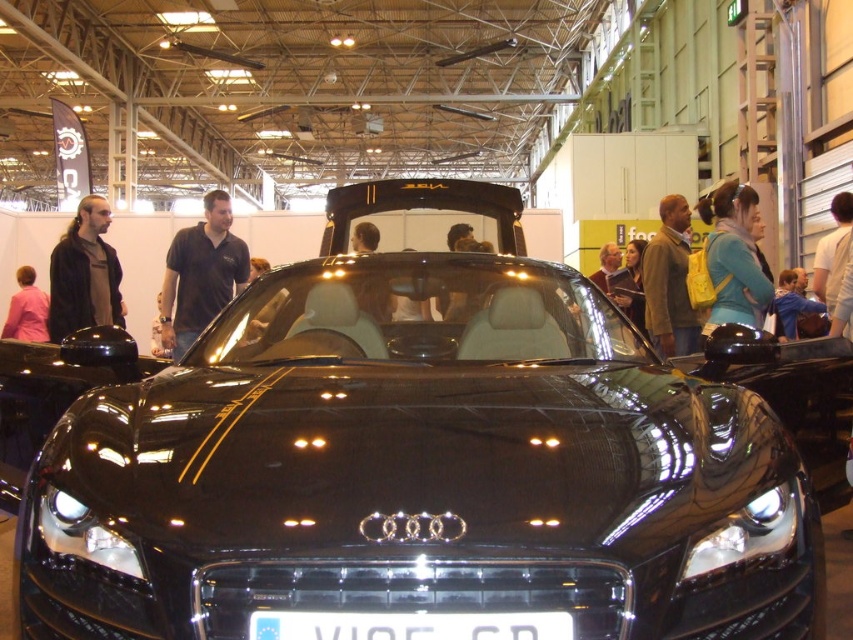
You are a photographer at the auto show and want to capture the black shirt at center and brown leather jacket at upper right in the same frame. Based on their positions, which object should be placed on the left side of the photo?

The black shirt at center should be placed on the left side of the photo since it is positioned to the left of the brown leather jacket at upper right.

You are standing at the entrance of the auto show and see two points marked in the image. Which point is closer to you, point (x=448, y=342) or point (x=836, y=280)?

Point (x=448, y=342) is in front of point (x=836, y=280), so it is closer to you.

You are a photographer at the auto show and need to capture the golden stripe on the Audi car. You see a dark brown leather jacket at left and a pink fabric at lower left. Which object is positioned higher in the image?

The dark brown leather jacket at left is above the pink fabric at lower left, so it is positioned higher in the image.